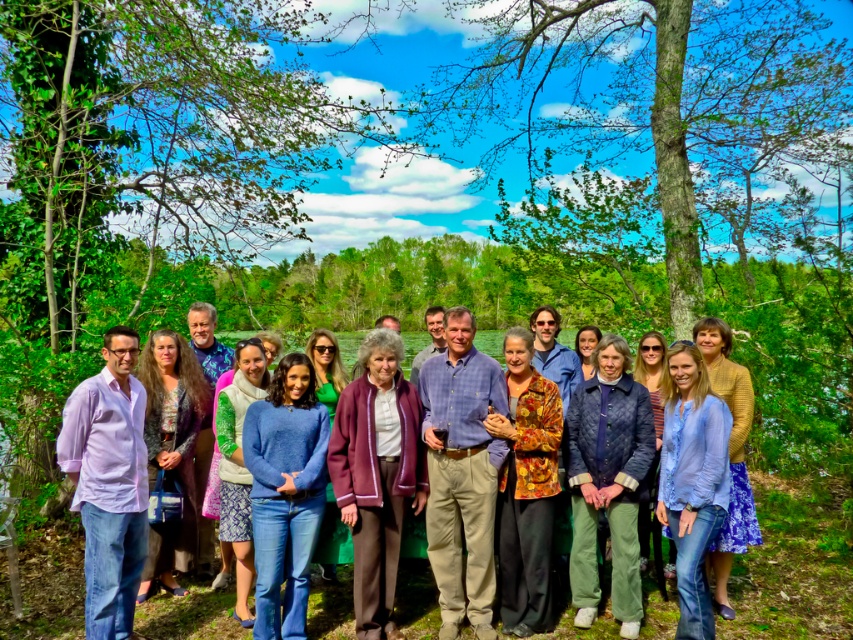
Which is in front, point (38, 38) or point (734, 545)?

Point (734, 545)

Is point (135, 266) positioned before point (744, 483)?

No, it is behind (744, 483).

Where is `green leafy tree at center`? This screenshot has width=853, height=640. green leafy tree at center is located at coordinates (144, 173).

Is point (427, 456) less distant than point (343, 406)?

No, it is not.

Can you confirm if blue cotton shirt at center is positioned below purple woolen sweater at center?

No, blue cotton shirt at center is not below purple woolen sweater at center.

Identify the location of blue cotton shirt at center. (461, 472).

Between textured gray sweater at center and blue cotton sweater at center, which one is positioned higher?

textured gray sweater at center is above.

Is textured gray sweater at center to the left of blue cotton sweater at center from the viewer's perspective?

Yes, textured gray sweater at center is to the left of blue cotton sweater at center.

Find the location of `textured gray sweater at center`. textured gray sweater at center is located at coordinates (171, 449).